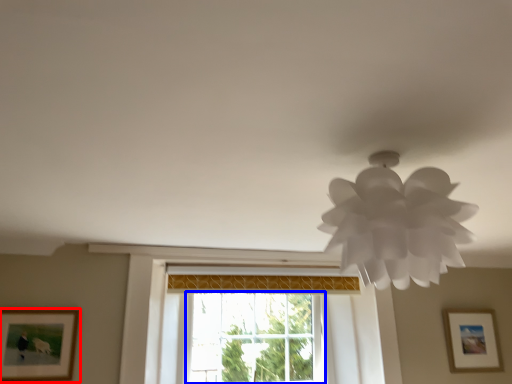
Question: Which of the following is the farthest to the observer, picture frame (highlighted by a red box) or window (highlighted by a blue box)?

Choices:
 (A) picture frame
 (B) window

Answer: (B)